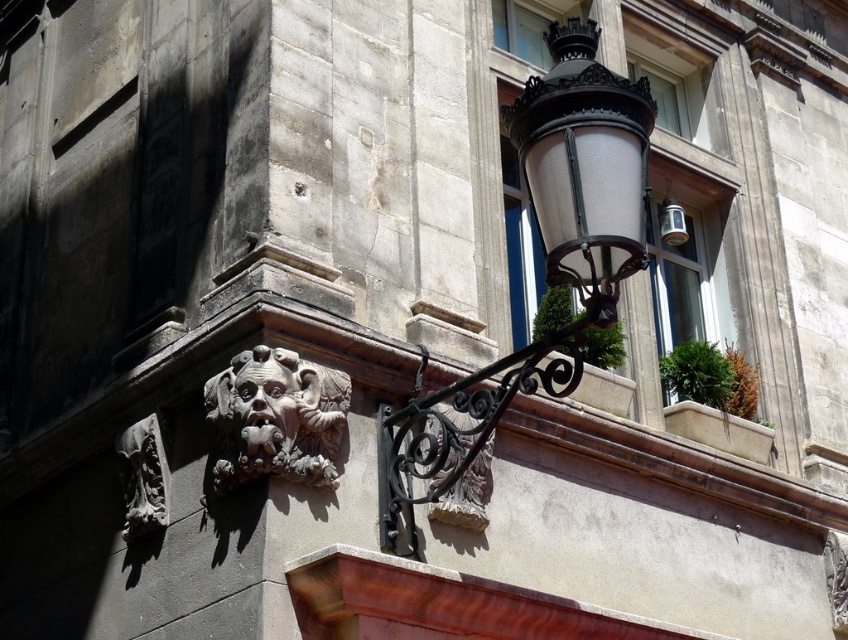
Question: Which point appears farthest from the camera in this image?

Choices:
 (A) (160, 451)
 (B) (589, 116)
 (C) (279, 362)

Answer: (A)

Question: Does black wrought iron streetlight at upper right appear under carved stone gargoyle at center-left?

Choices:
 (A) yes
 (B) no

Answer: (B)

Question: Which of these objects is positioned farthest from the black wrought iron streetlight at upper right?

Choices:
 (A) carved stone gargoyle at lower left
 (B) carved stone gargoyle at center-left

Answer: (A)

Question: In this image, where is black wrought iron streetlight at upper right located relative to carved stone gargoyle at lower left?

Choices:
 (A) above
 (B) below

Answer: (A)

Question: Does black wrought iron streetlight at upper right lie behind carved stone gargoyle at center-left?

Choices:
 (A) no
 (B) yes

Answer: (A)

Question: Which object is closer to the camera taking this photo?

Choices:
 (A) carved stone gargoyle at center-left
 (B) carved stone gargoyle at lower left

Answer: (A)